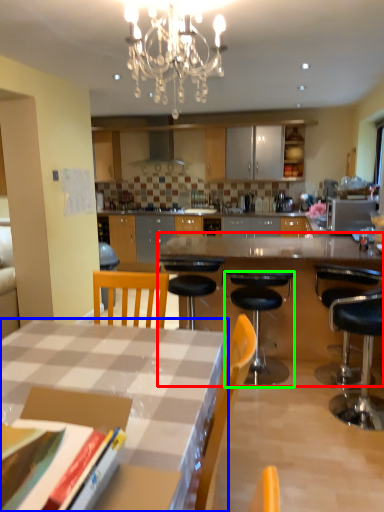
Question: Estimate the real-world distances between objects in this image. Which object is closer to table (highlighted by a red box), desk (highlighted by a blue box) or chair (highlighted by a green box)?

Choices:
 (A) desk
 (B) chair

Answer: (B)